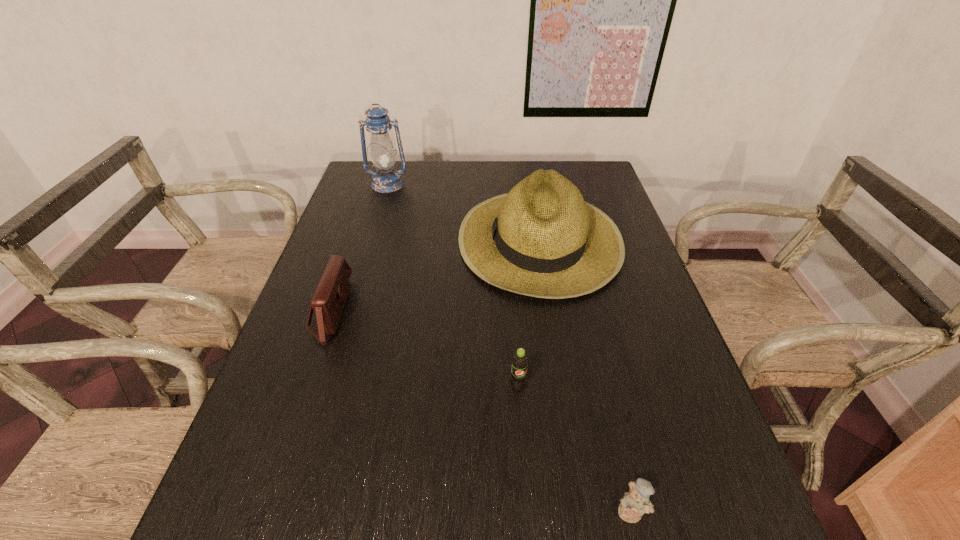
Identify the location of object that is the nearest to the shoulder bag. The width and height of the screenshot is (960, 540). (542, 239).

You are a GUI agent. You are given a task and a screenshot of the screen. Output one action in this format:
    pyautogui.click(x=<x>, y=<y>)
    Task: Click on the object that stands as the closest to the shoulder bag
    This screenshot has width=960, height=540.
    Given the screenshot: What is the action you would take?
    (x=542, y=239)

In order to click on vacant position in the image that satisfies the following two spatial constraints: 1. on the front-facing side of the lantern; 2. on the front flap of the shoulder bag in this screenshot , I will do `click(349, 311)`.

What are the coordinates of `vacant space that satisfies the following two spatial constraints: 1. on the front-facing side of the fourth shortest object; 2. on the right side of the lantern` in the screenshot? It's located at (372, 239).

Identify the location of free spot that satisfies the following two spatial constraints: 1. on the front-facing side of the sunhat; 2. on the right side of the lantern. The width and height of the screenshot is (960, 540). (372, 239).

Locate an element on the screen. The height and width of the screenshot is (540, 960). vacant area that satisfies the following two spatial constraints: 1. on the front-facing side of the lantern; 2. on the right side of the sunhat is located at coordinates (372, 239).